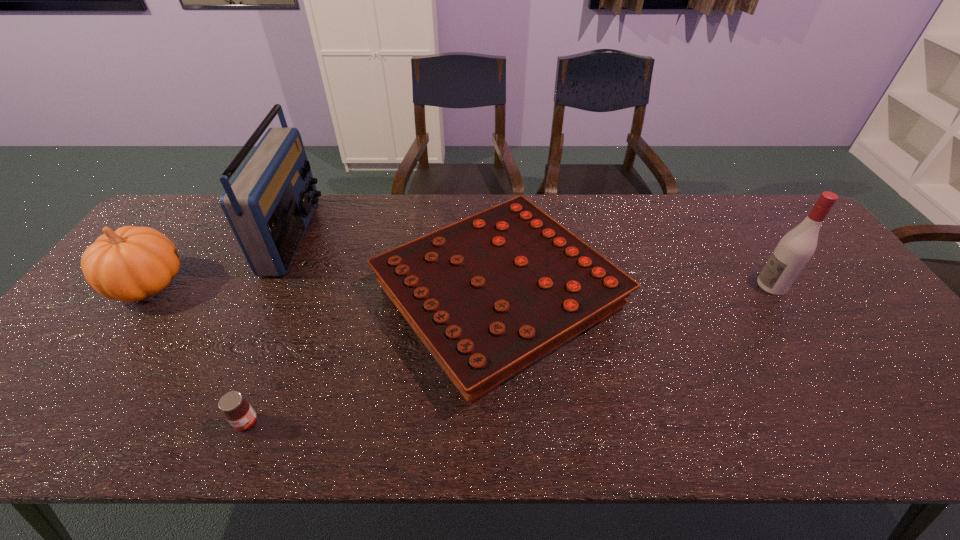
I want to click on vacant region that satisfies the following two spatial constraints: 1. on the label of the rightmost object; 2. on the label side of the third object from right to left, so coord(861,423).